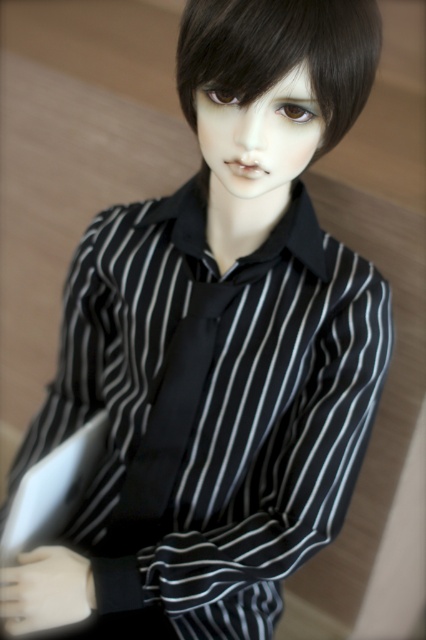
What is the exact position of the black silky hair at center in the image?

The black silky hair at center is located at point (281, 52).

You are a tailor measuring the height of the black silky hair at center and the black satin tie at center for a custom suit. Which object is shorter?

The black silky hair at center is shorter than the black satin tie at center.